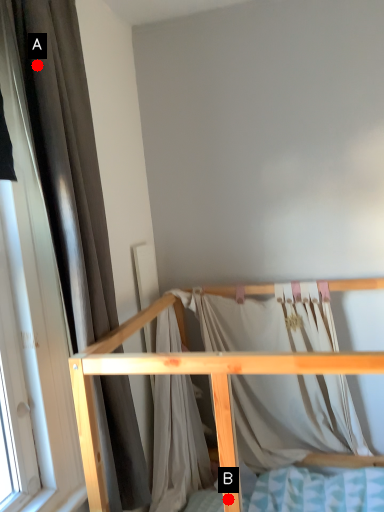
Question: Two points are circled on the image, labeled by A and B beside each circle. Which point is farther to the camera?

Choices:
 (A) A is further
 (B) B is further

Answer: (A)